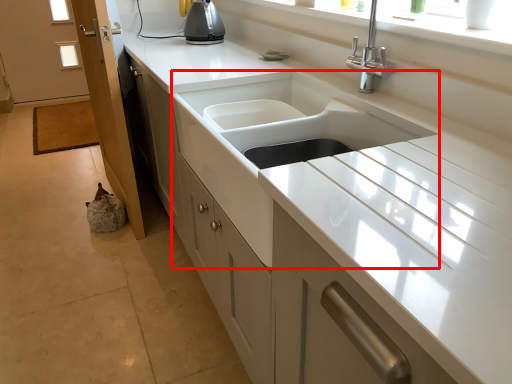
Question: In this image, where is sink (annotated by the red box) located relative to screen door?

Choices:
 (A) left
 (B) right

Answer: (B)